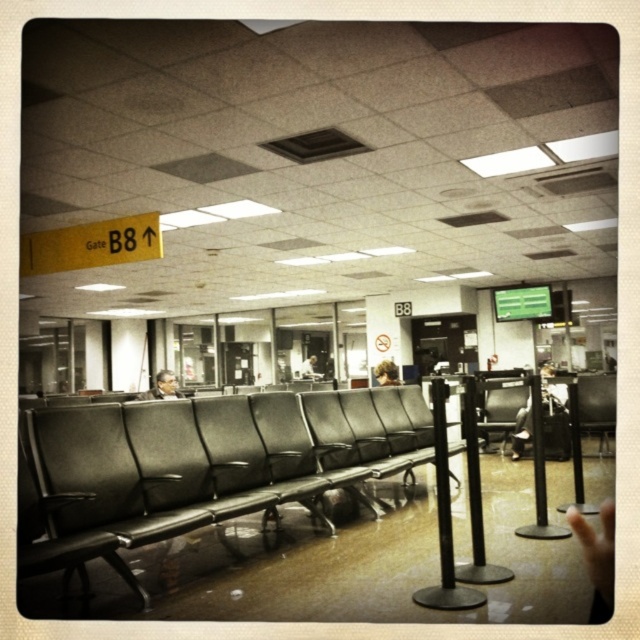
Where is `matte black seats at center`? The image size is (640, 640). matte black seats at center is located at coordinates (216, 458).